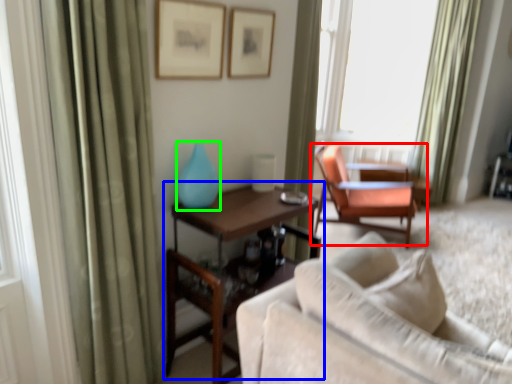
Question: Which object is the closest to the chair (highlighted by a red box)? Choose among these: table (highlighted by a blue box) or turquoise (highlighted by a green box).

Choices:
 (A) table
 (B) turquoise

Answer: (A)